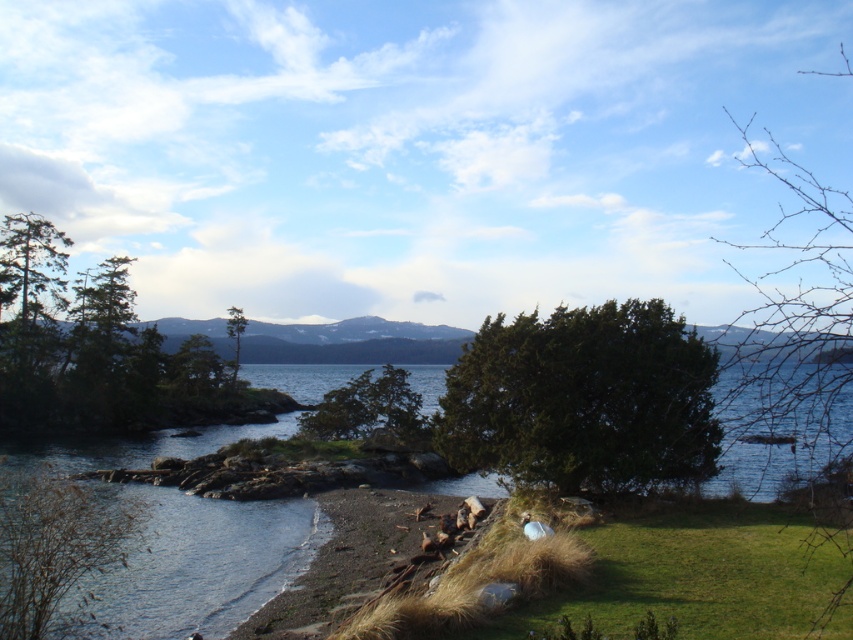
Question: Does brown textured tree at lower left lie in front of green leafy tree at upper center?

Choices:
 (A) no
 (B) yes

Answer: (B)

Question: Does green matte tree at left have a lesser width compared to green leafy tree at upper right?

Choices:
 (A) yes
 (B) no

Answer: (A)

Question: Among these objects, which one is farthest from the camera?

Choices:
 (A) green leafy tree at upper right
 (B) brown textured tree at lower left

Answer: (B)

Question: Based on their relative distances, which object is farther from the dark green textured tree at center?

Choices:
 (A) brown textured tree at lower left
 (B) green leafy tree at upper right
 (C) green leafy tree at center

Answer: (B)

Question: Estimate the real-world distances between objects in this image. Which object is farther from the green matte tree at left?

Choices:
 (A) brown textured tree at lower left
 (B) dark green textured tree at center

Answer: (B)

Question: Is brown textured tree at lower left wider than green leafy tree at upper center?

Choices:
 (A) yes
 (B) no

Answer: (B)